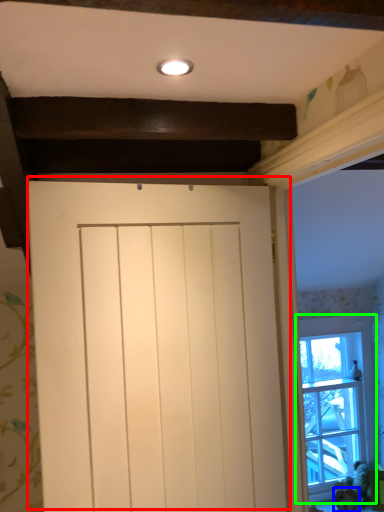
Question: Estimate the real-world distances between objects in this image. Which object is closer to door (highlighted by a red box), animal (highlighted by a blue box) or window (highlighted by a green box)?

Choices:
 (A) animal
 (B) window

Answer: (B)